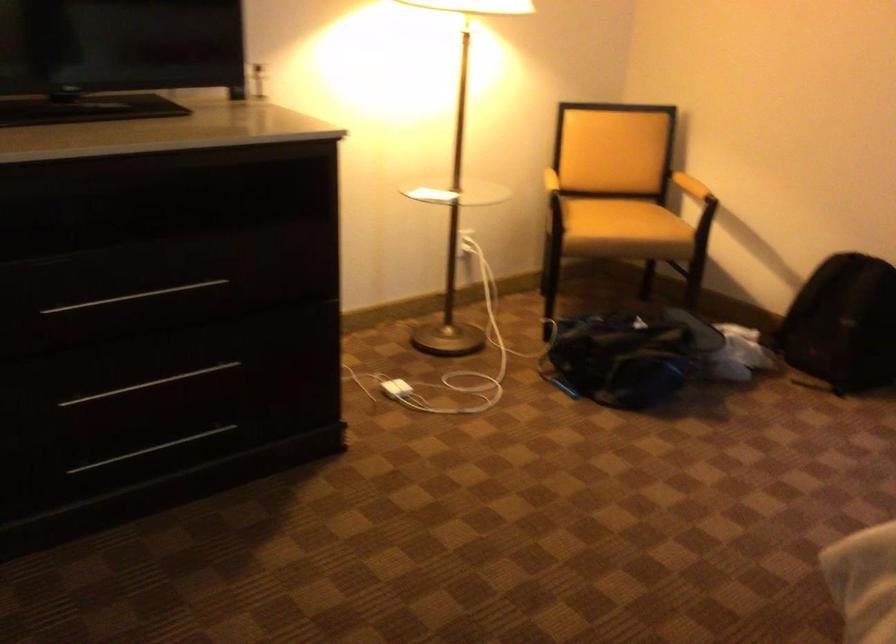
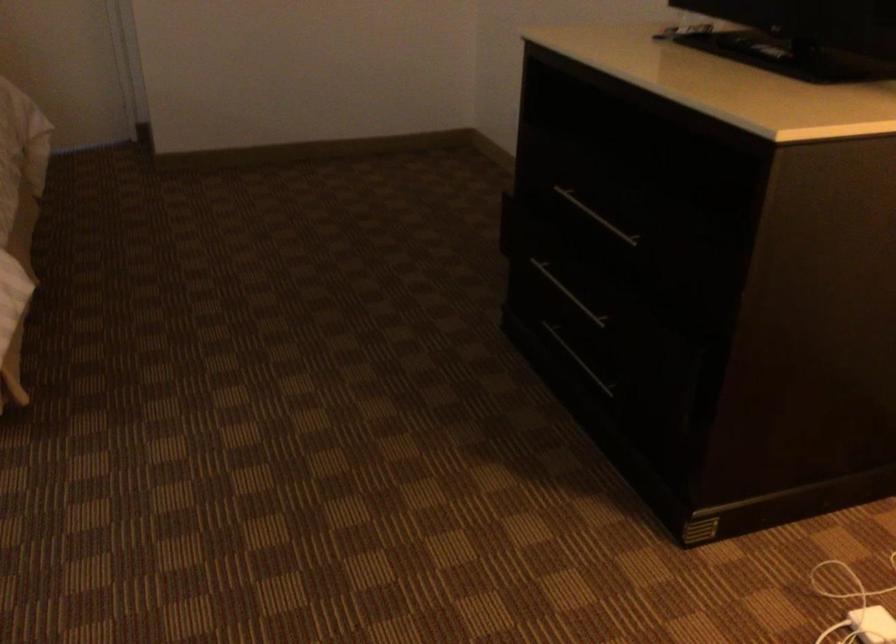
Find the pixel in the second image that matches the point at 106,305 in the first image.

(596, 216)